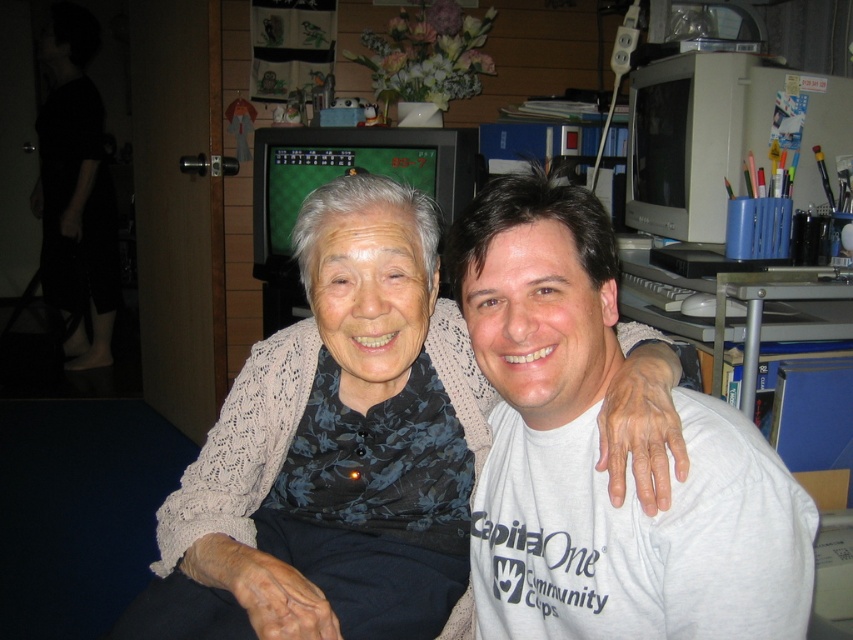
Is white cotton t-shirt at center below dark blue fabric at lower left?

Actually, white cotton t-shirt at center is above dark blue fabric at lower left.

This screenshot has height=640, width=853. What are the coordinates of `white cotton t-shirt at center` in the screenshot? It's located at (596, 448).

At what (x,y) coordinates should I click in order to perform the action: click on white cotton t-shirt at center. Please return your answer as a coordinate pair (x, y). The width and height of the screenshot is (853, 640). Looking at the image, I should click on (596, 448).

What do you see at coordinates (335, 451) in the screenshot? Image resolution: width=853 pixels, height=640 pixels. I see `knitted beige sweater at center` at bounding box center [335, 451].

The image size is (853, 640). Find the location of `knitted beige sweater at center`. knitted beige sweater at center is located at coordinates (335, 451).

At what (x,y) coordinates should I click in order to perform the action: click on knitted beige sweater at center. Please return your answer as a coordinate pair (x, y). Looking at the image, I should click on (335, 451).

Is knitted beige sweater at center wider than dark blue fabric at lower left?

Correct, the width of knitted beige sweater at center exceeds that of dark blue fabric at lower left.

Find the location of a particular element. This screenshot has width=853, height=640. knitted beige sweater at center is located at coordinates (335, 451).